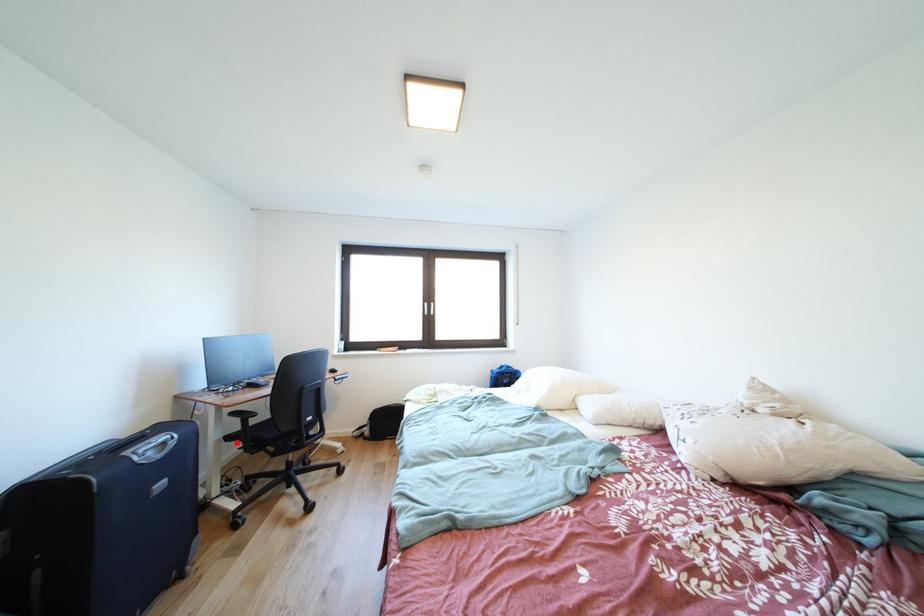
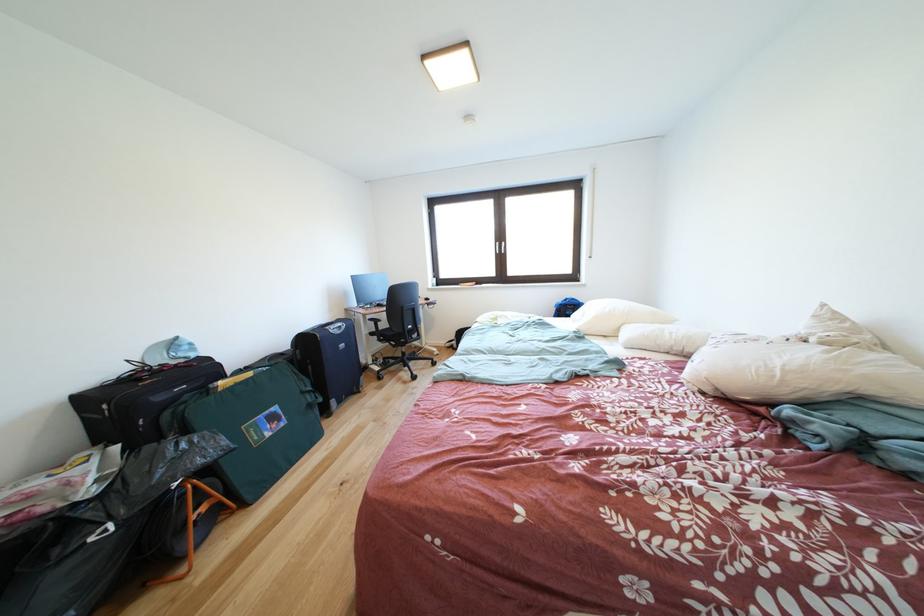
Question: I am providing you with two images of the same scene from different viewpoints. Given a red point in image1, look at the same physical point in image2. Is it:

Choices:
 (A) Closer to the viewpoint
 (B) Farther from the viewpoint

Answer: (A)